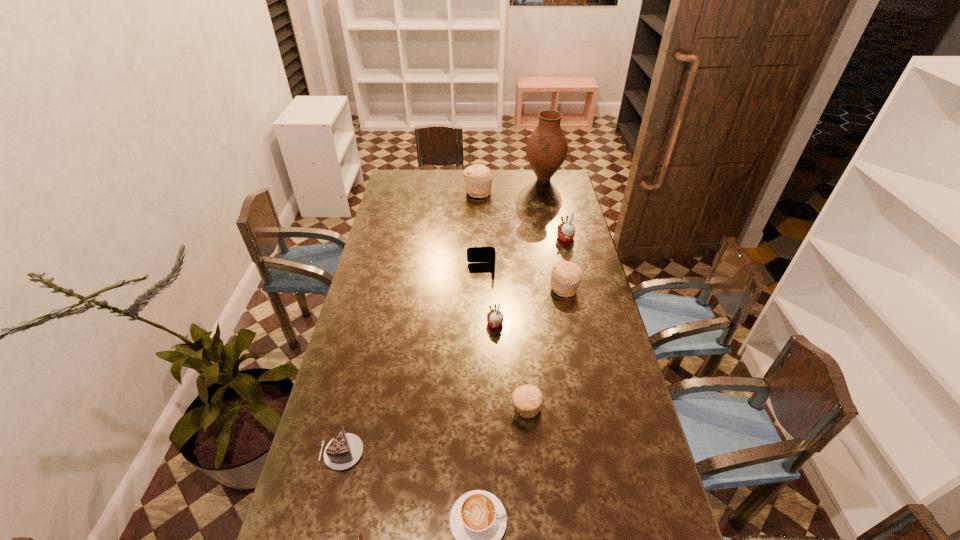
Locate an element on the screen. vase is located at coordinates (546, 150).

Find the location of a particular element. This screenshot has height=540, width=960. the tallest muffin is located at coordinates (478, 178).

Where is `the biggest beige muffin`? This screenshot has width=960, height=540. the biggest beige muffin is located at coordinates (478, 178).

At what (x,y) coordinates should I click in order to perform the action: click on the third farthest object. Please return your answer as a coordinate pair (x, y). Looking at the image, I should click on (566, 231).

The height and width of the screenshot is (540, 960). What are the coordinates of `the fourth nearest muffin` in the screenshot? It's located at (566, 231).

The width and height of the screenshot is (960, 540). I want to click on the second nearest beige muffin, so click(566, 276).

The image size is (960, 540). Find the location of `the rightmost beige muffin`. the rightmost beige muffin is located at coordinates 566,276.

This screenshot has width=960, height=540. Identify the location of the second nearest muffin. (495, 318).

This screenshot has width=960, height=540. I want to click on the fifth nearest object, so click(495, 318).

Locate an element on the screen. The image size is (960, 540). the smallest beige muffin is located at coordinates (527, 399).